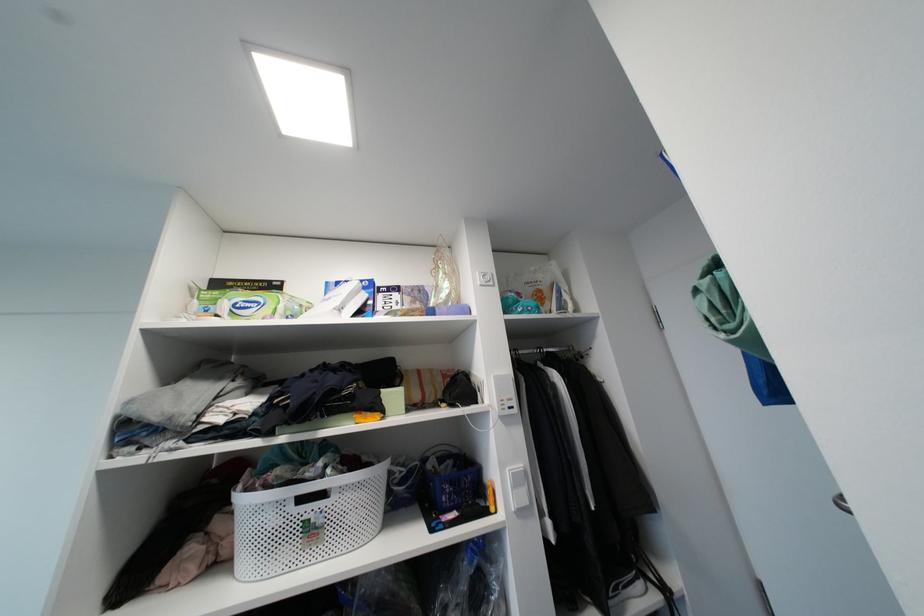
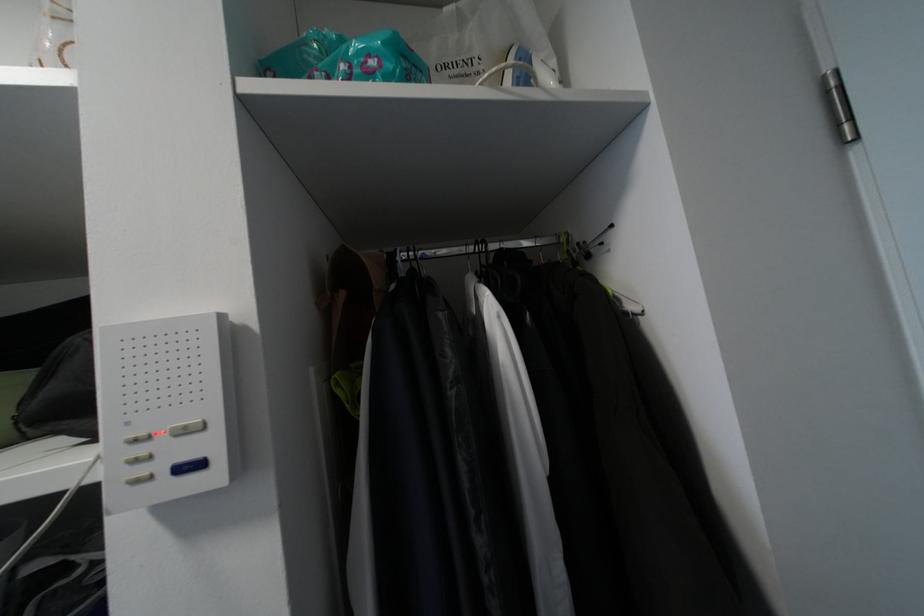
In a continuous first-person perspective shot, in which direction is the camera moving?

The cameraman walked toward right, forward.